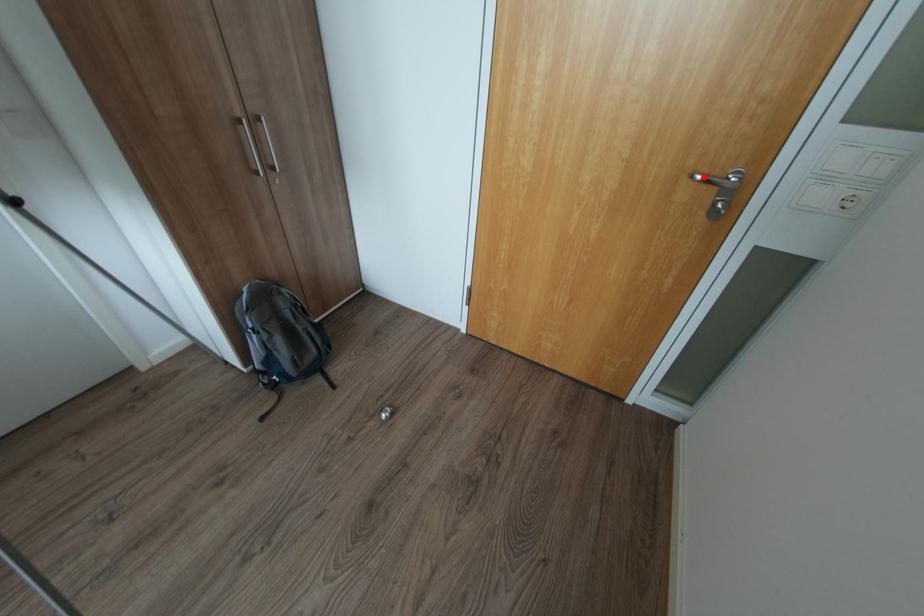
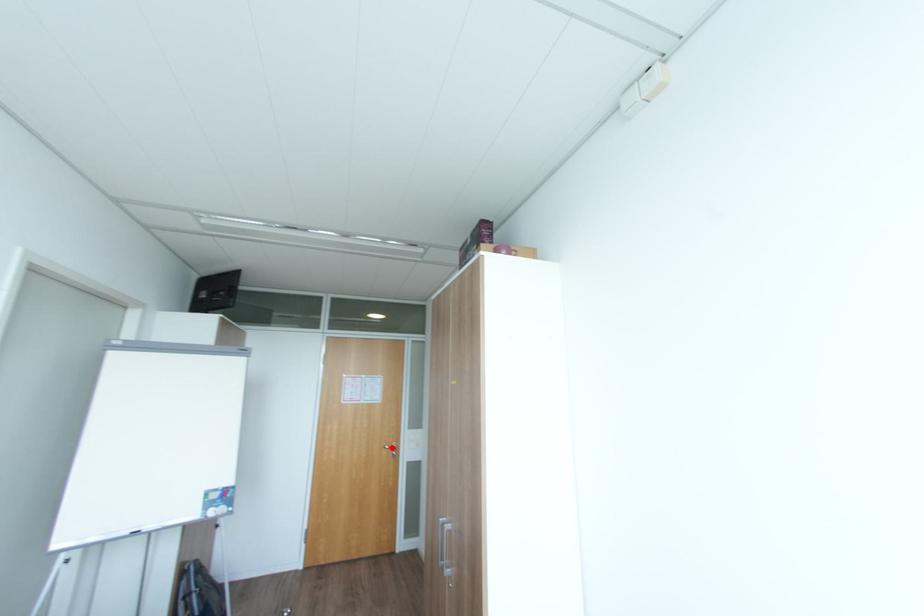
I am providing you with two images of the same scene from different viewpoints. A red point is marked on the first image and another point is marked on the second image. Does the point marked in image1 correspond to the same location as the one in image2?

Yes